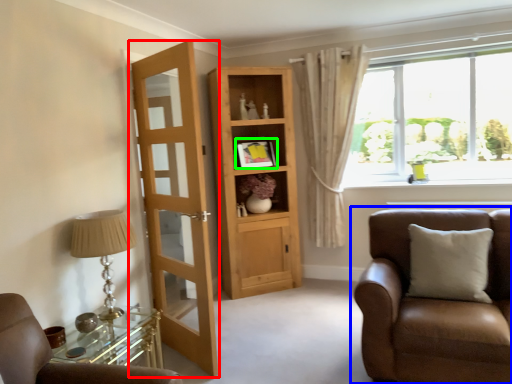
Question: Which is farther away from door (highlighted by a red box)? chair (highlighted by a blue box) or picture frame (highlighted by a green box)?

Choices:
 (A) chair
 (B) picture frame

Answer: (A)